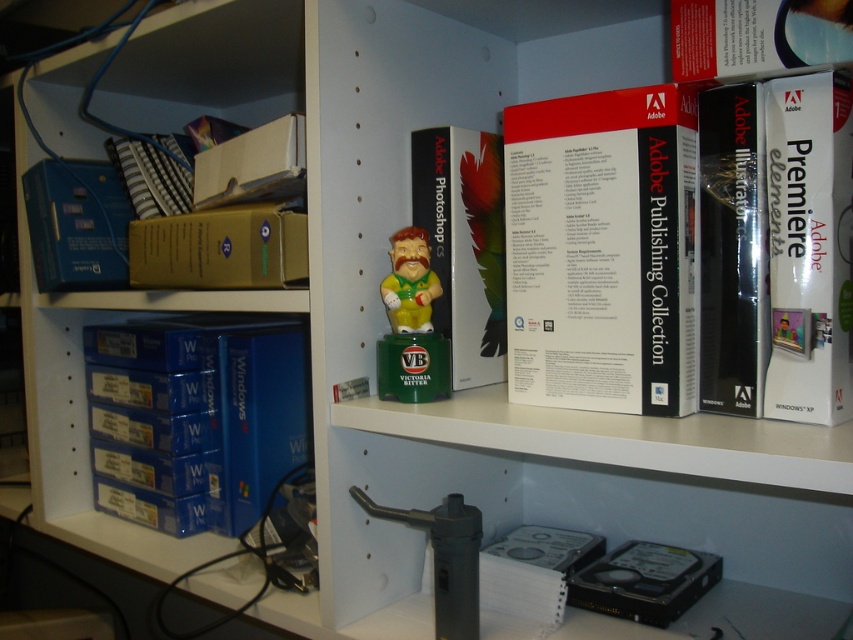
You are organizing a shelf and need to place a new item between the black plastic adobe illustrator at center and the matte plastic bobblehead at center. If the new item requires 12 inches of space, will there be enough room between them?

The distance between the black plastic adobe illustrator at center and the matte plastic bobblehead at center is 10.51 inches. Since the new item requires 12 inches, there isn not enough space between them to accommodate it.

You are organizing a shelf and need to place a new item between the white matte adobe publishing collection at center and the white matte adobe premiere elements at upper right. Considering their sizes, which one should you place closer to the bottom to avoid instability?

You should place the white matte adobe publishing collection at center closer to the bottom because it is much taller than the white matte adobe premiere elements at upper right, and heavier items are typically placed lower for stability.